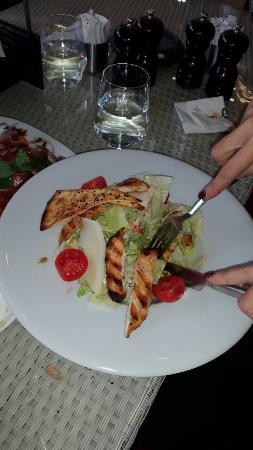
This screenshot has width=253, height=450. Identify the location of wicker. (59, 415).